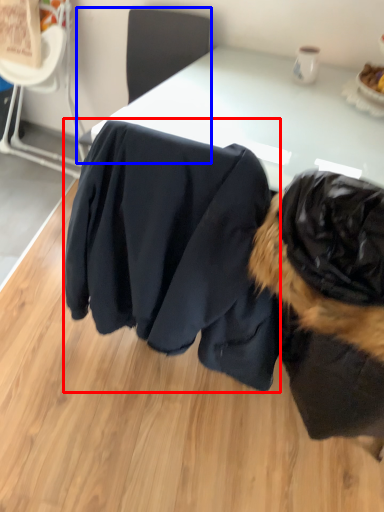
Question: Which of the following is the farthest to the observer, clothing (highlighted by a red box) or chair (highlighted by a blue box)?

Choices:
 (A) clothing
 (B) chair

Answer: (B)